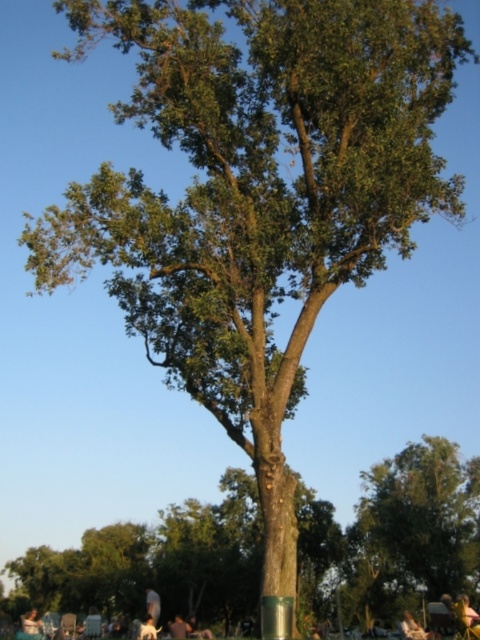
You are sitting on the light brown wooden chair at lower left and want to look at the green rough bark tree at center. In which direction should you turn your head to see it?

The green rough bark tree at center is positioned on the right side of light brown wooden chair at lower left, so you should turn your head to the right to see it.

You are a photographer trying to capture the central tree with its surroundings. You notice a white fur dog at lower center and a dark gray fabric shirt at lower center in the frame. Which object appears narrower in the image?

The white fur dog at lower center appears narrower than the dark gray fabric shirt at lower center in the image.

You are sitting on the light brown wooden chair at lower left and want to pet the white fur dog at lower center. Can you reach the dog without moving from the chair?

The light brown wooden chair at lower left is larger than the white fur dog at lower center, so you can easily reach the dog without moving from the chair.